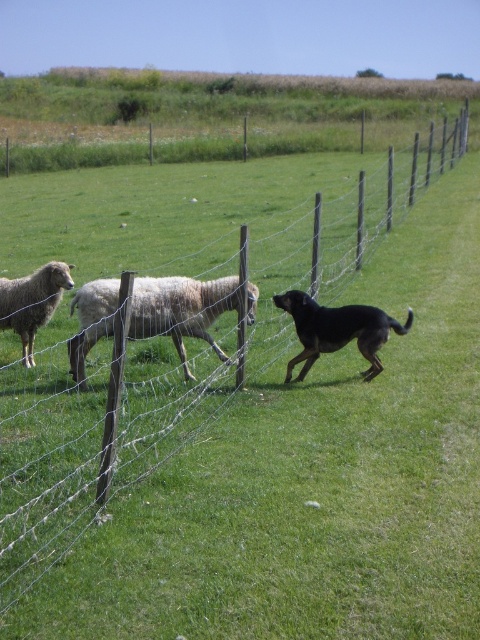
You are a farmer who needs to decide which animal to catch first between the white woolen sheep at center and the black matte dog at center. Which one is larger?

The white woolen sheep at center is bigger than the black matte dog at center, so you should catch the white woolen sheep at center first.

You are standing at the center of the image and want to locate the white woolen sheep at center. Which direction should you look to find it?

Since the white woolen sheep at center is located at point (180,308), which is very close to the center of the image, you should look straight ahead to find it.